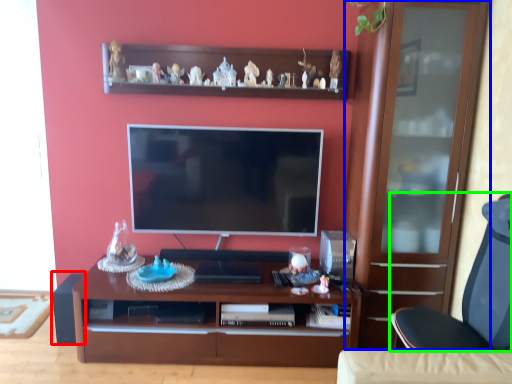
Question: Estimate the real-world distances between objects in this image. Which object is closer to speaker (highlighted by a red box), cabinetry (highlighted by a blue box) or chair (highlighted by a green box)?

Choices:
 (A) cabinetry
 (B) chair

Answer: (B)